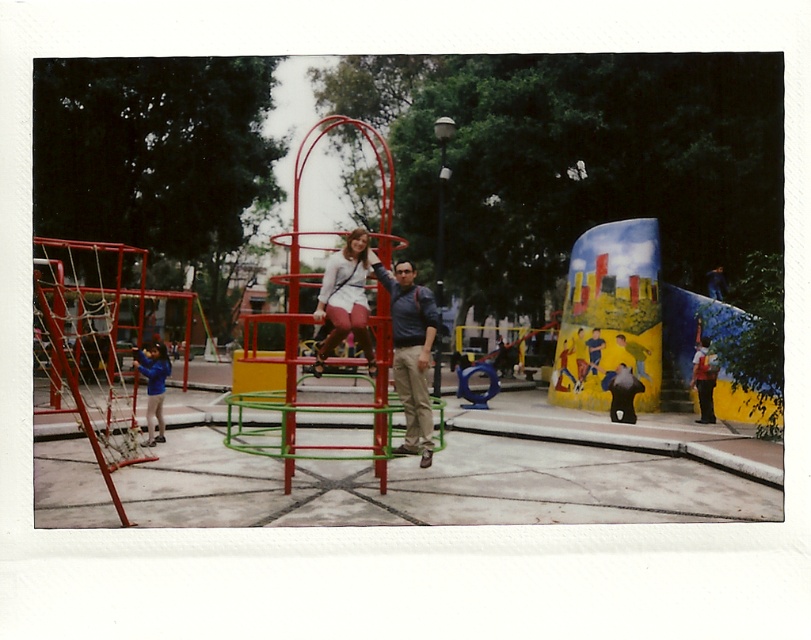
You are a parent at the playground and see the blue fleece jacket at lower left and the red fabric jacket at right. Which jacket is closer to the ground?

The blue fleece jacket at lower left is closer to the ground because it is positioned under the red fabric jacket at right.

Based on the photo, you are a photographer trying to capture both the matte blue shirt at center and the blue fleece jacket at lower left in the same frame. Which clothing item should you focus on first to ensure both are in the frame?

Since the matte blue shirt at center is bigger than the blue fleece jacket at lower left, you should focus on the matte blue shirt at center first to ensure both are in the frame.

You are standing at the playground and want to determine which of the two points, point (402, 336) or point (374, 360), is closer to you. Based on the scene description, which point is nearer?

Point (402, 336) is closer to the viewer than point (374, 360).